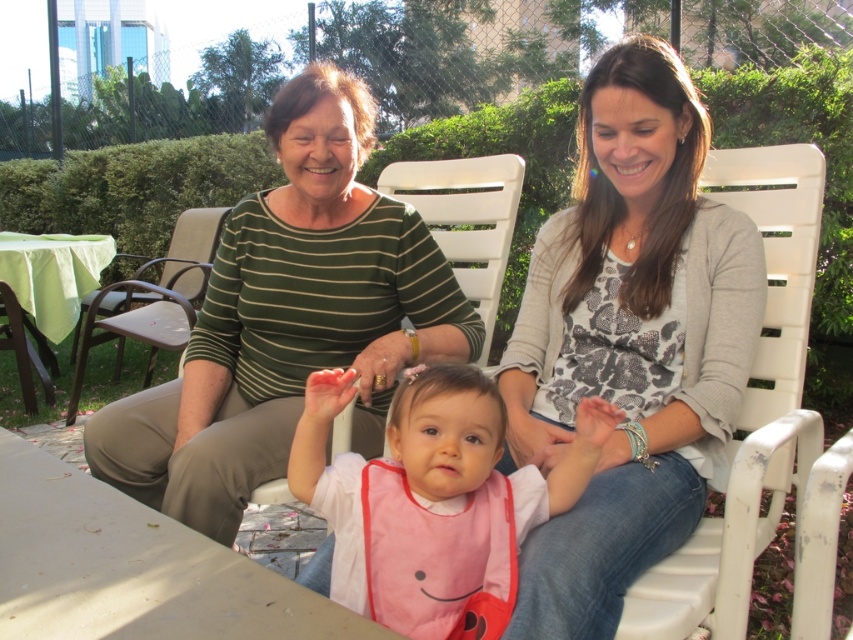
Does pink fabric bib at center have a smaller size compared to brown leather chair at left?

Yes, pink fabric bib at center is smaller than brown leather chair at left.

Between pink fabric bib at center and brown leather chair at left, which one has less height?

pink fabric bib at center

Identify the location of pink fabric bib at center. (483, 448).

Does matte gray sweater at center come in front of pink fabric bib at center?

Yes.

You are a GUI agent. You are given a task and a screenshot of the screen. Output one action in this format:
    pyautogui.click(x=<x>, y=<y>)
    Task: Click on the matte gray sweater at center
    The width and height of the screenshot is (853, 640).
    Given the screenshot: What is the action you would take?
    pyautogui.click(x=630, y=340)

What do you see at coordinates (630, 340) in the screenshot? I see `matte gray sweater at center` at bounding box center [630, 340].

Where is `matte gray sweater at center`? This screenshot has height=640, width=853. matte gray sweater at center is located at coordinates (630, 340).

The height and width of the screenshot is (640, 853). Describe the element at coordinates (630, 340) in the screenshot. I see `matte gray sweater at center` at that location.

Consider the image. Can you confirm if matte gray sweater at center is positioned to the left of brown leather chair at left?

No, matte gray sweater at center is not to the left of brown leather chair at left.

What do you see at coordinates (630, 340) in the screenshot? I see `matte gray sweater at center` at bounding box center [630, 340].

This screenshot has width=853, height=640. Find the location of `matte gray sweater at center`. matte gray sweater at center is located at coordinates (630, 340).